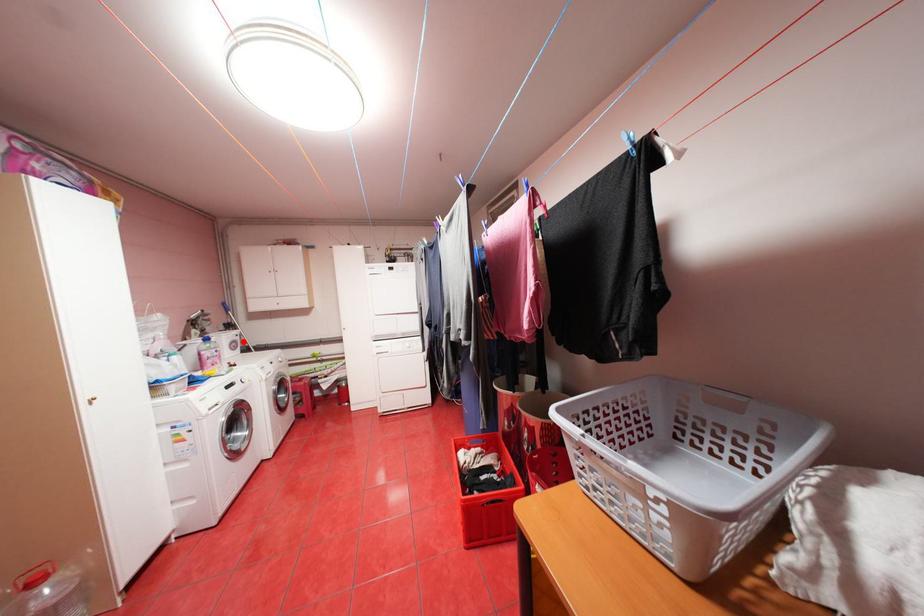
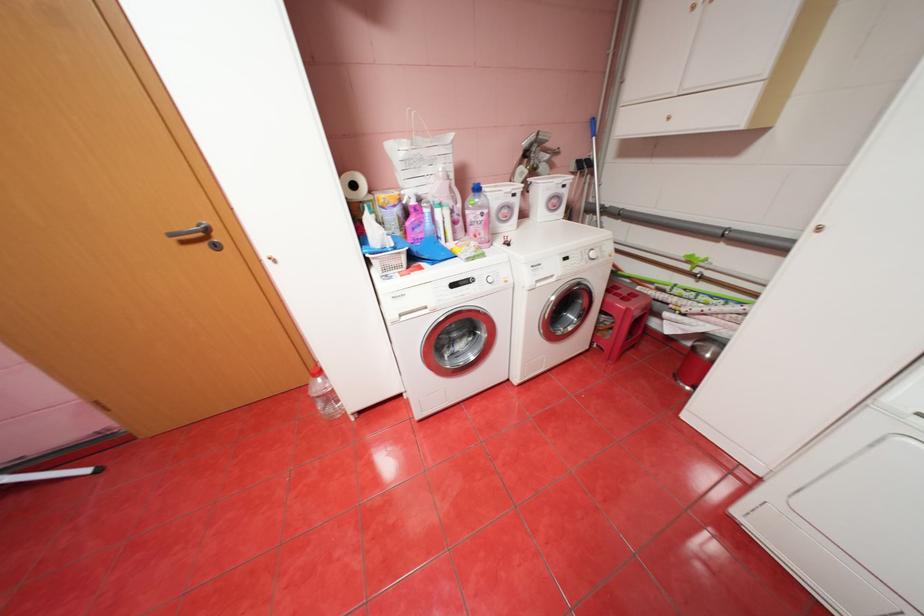
In the second image, find the point that corresponds to the highlighted location in the first image.

(566, 197)